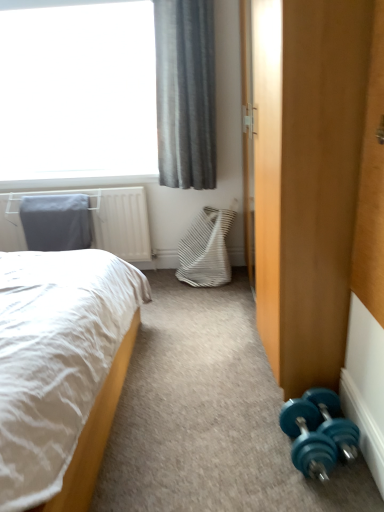
Image resolution: width=384 pixels, height=512 pixels. Identify the location of vacant area on the back side of teal rubber dumbbell at lower right, the second dumbbell positioned from the right. (255, 402).